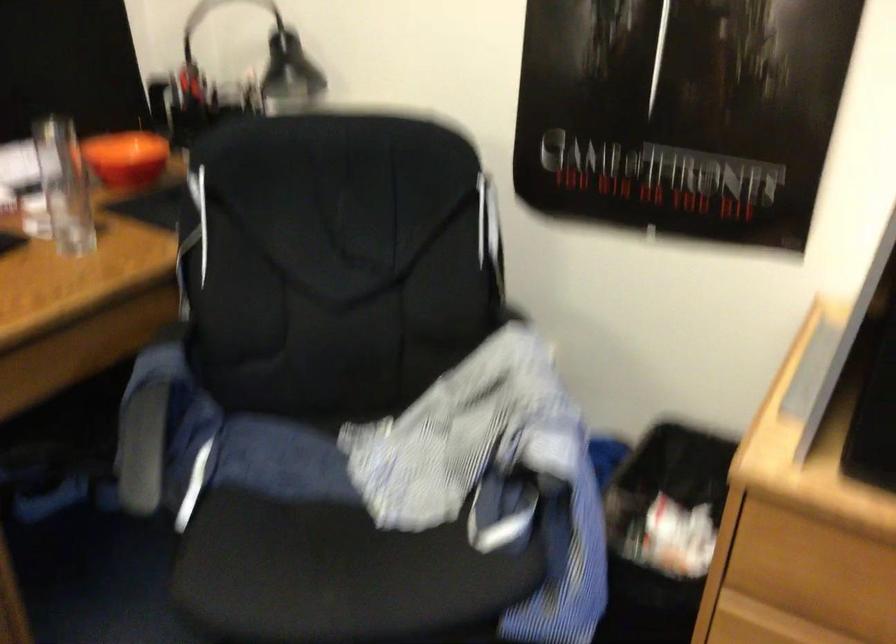
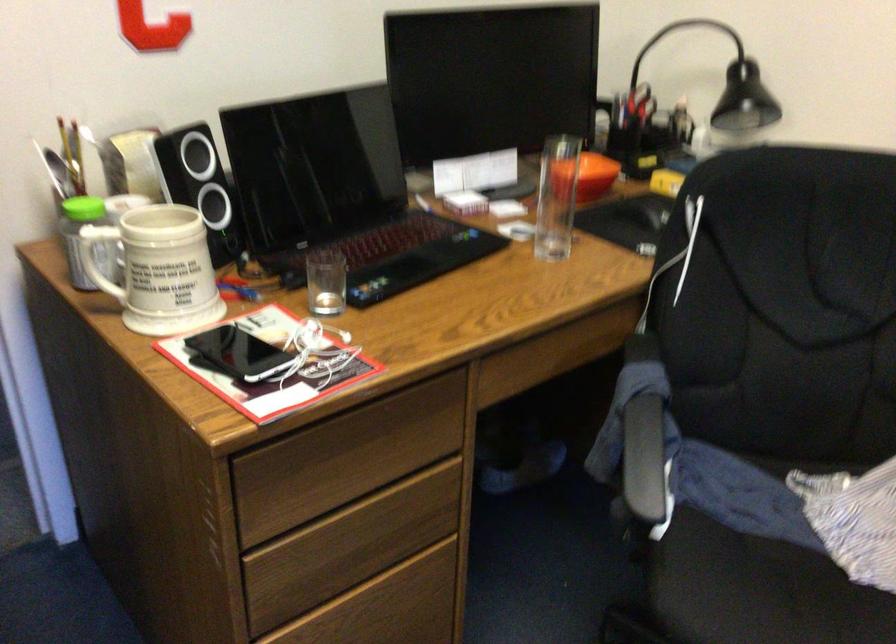
Find the pixel in the second image that matches pixel 138 163 in the first image.

(590, 176)